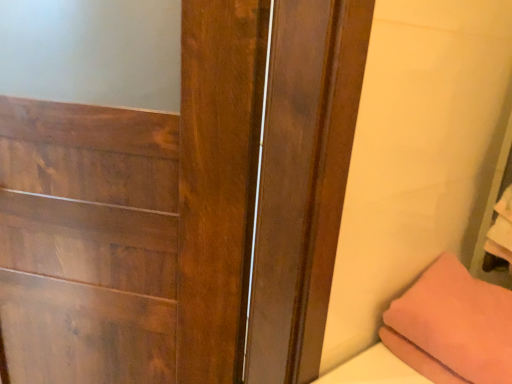
Question: Which is correct: wooden door at center is inside pink fabric pillow at lower right, or outside of it?

Choices:
 (A) inside
 (B) outside

Answer: (B)

Question: Does point (181, 150) appear closer or farther from the camera than point (501, 377)?

Choices:
 (A) farther
 (B) closer

Answer: (A)

Question: Considering the relative positions of wooden door at center and pink fabric pillow at lower right in the image provided, is wooden door at center to the left or to the right of pink fabric pillow at lower right?

Choices:
 (A) left
 (B) right

Answer: (A)

Question: Looking at their shapes, would you say pink fabric pillow at lower right is wider or thinner than wooden door at center?

Choices:
 (A) thin
 (B) wide

Answer: (B)

Question: Visually, is pink fabric pillow at lower right positioned to the left or to the right of wooden door at center?

Choices:
 (A) right
 (B) left

Answer: (A)

Question: In the image, is pink fabric pillow at lower right positioned in front of or behind wooden door at center?

Choices:
 (A) behind
 (B) front

Answer: (A)

Question: Is point (428, 354) closer or farther from the camera than point (90, 254)?

Choices:
 (A) farther
 (B) closer

Answer: (B)